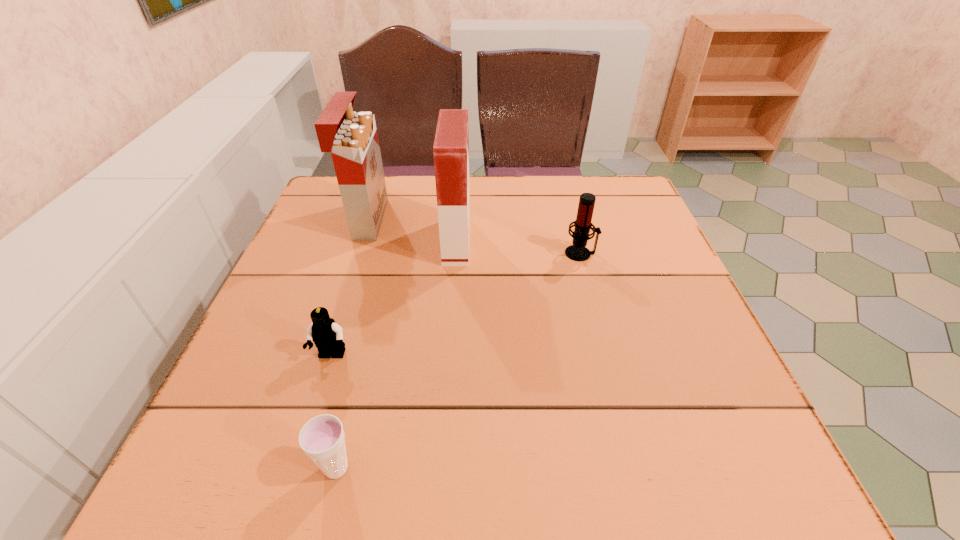
This screenshot has width=960, height=540. I want to click on free space between the third shortest object and the right cigarette_case, so click(x=518, y=247).

Locate an element on the screen. the closest object to the microphone is located at coordinates (451, 145).

Identify which object is located as the second nearest to the second nearest object. Please provide its 2D coordinates. Your answer should be formatted as a tuple, i.e. [(x, y)], where the tuple contains the x and y coordinates of a point satisfying the conditions above.

[(451, 145)]

I want to click on vacant point that satisfies the following two spatial constraints: 1. on the front-facing side of the right cigarette_case; 2. on the front side of the cup, so click(x=443, y=468).

This screenshot has height=540, width=960. I want to click on free space that satisfies the following two spatial constraints: 1. on the front-facing side of the right cigarette_case; 2. on the right side of the third shortest object, so click(456, 253).

Identify the location of vacant space that satisfies the following two spatial constraints: 1. on the front-facing side of the right cigarette_case; 2. on the left side of the rightmost object. The image size is (960, 540). (456, 253).

Where is `blank area in the image that satisfies the following two spatial constraints: 1. on the front-facing side of the right cigarette_case; 2. on the front-facing side of the second nearest object`? The height and width of the screenshot is (540, 960). blank area in the image that satisfies the following two spatial constraints: 1. on the front-facing side of the right cigarette_case; 2. on the front-facing side of the second nearest object is located at coordinates (449, 356).

Where is `free space that satisfies the following two spatial constraints: 1. on the front-facing side of the Lego; 2. on the right side of the nearest object`? The image size is (960, 540). free space that satisfies the following two spatial constraints: 1. on the front-facing side of the Lego; 2. on the right side of the nearest object is located at coordinates (297, 468).

Where is `vacant area that satisfies the following two spatial constraints: 1. on the front-facing side of the cup; 2. on the right side of the Lego`? The image size is (960, 540). vacant area that satisfies the following two spatial constraints: 1. on the front-facing side of the cup; 2. on the right side of the Lego is located at coordinates (297, 468).

Identify the location of blank area in the image that satisfies the following two spatial constraints: 1. on the front-facing side of the right cigarette_case; 2. on the back side of the third shortest object. This screenshot has height=540, width=960. click(456, 253).